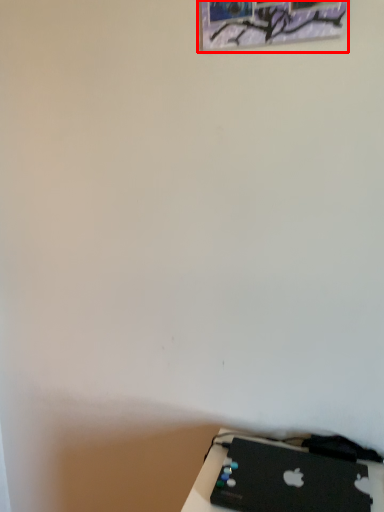
Question: Where is picture frame (annotated by the red box) located in relation to laptop in the image?

Choices:
 (A) right
 (B) left

Answer: (B)